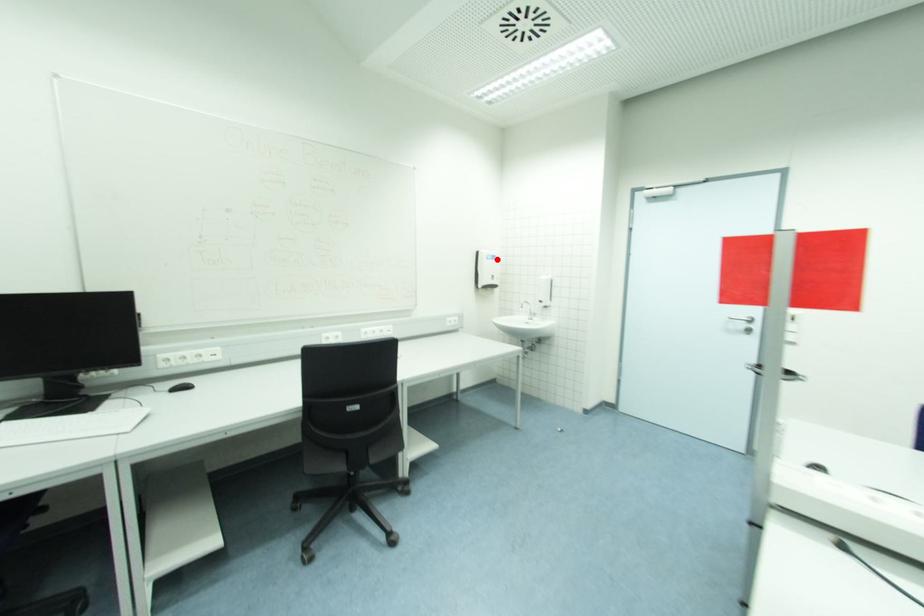
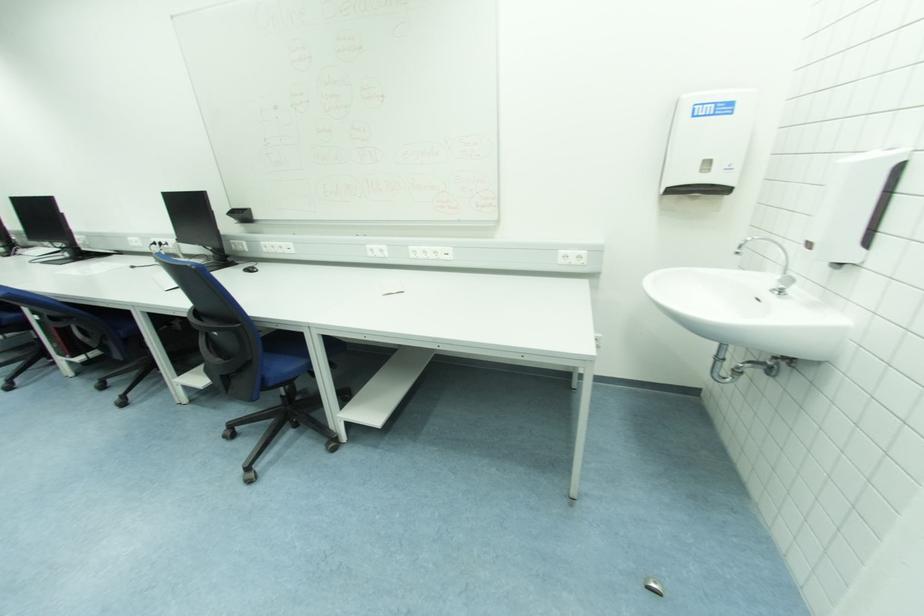
In the second image, find the point that corresponds to the highlighted location in the first image.

(731, 110)